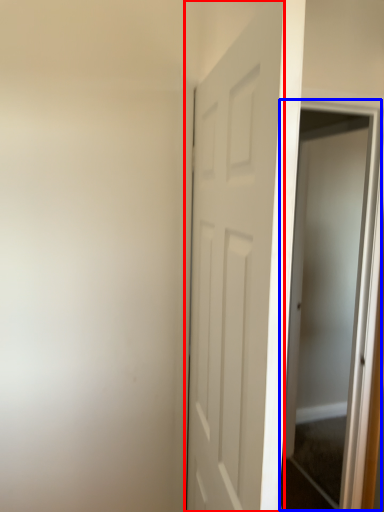
Question: Among these objects, which one is farthest to the camera, door (highlighted by a red box) or screen door (highlighted by a blue box)?

Choices:
 (A) door
 (B) screen door

Answer: (B)